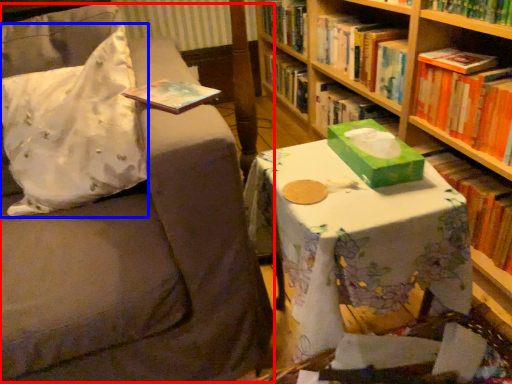
Question: Which object is closer to the camera taking this photo, swivel chair (highlighted by a red box) or throw pillow (highlighted by a blue box)?

Choices:
 (A) swivel chair
 (B) throw pillow

Answer: (A)